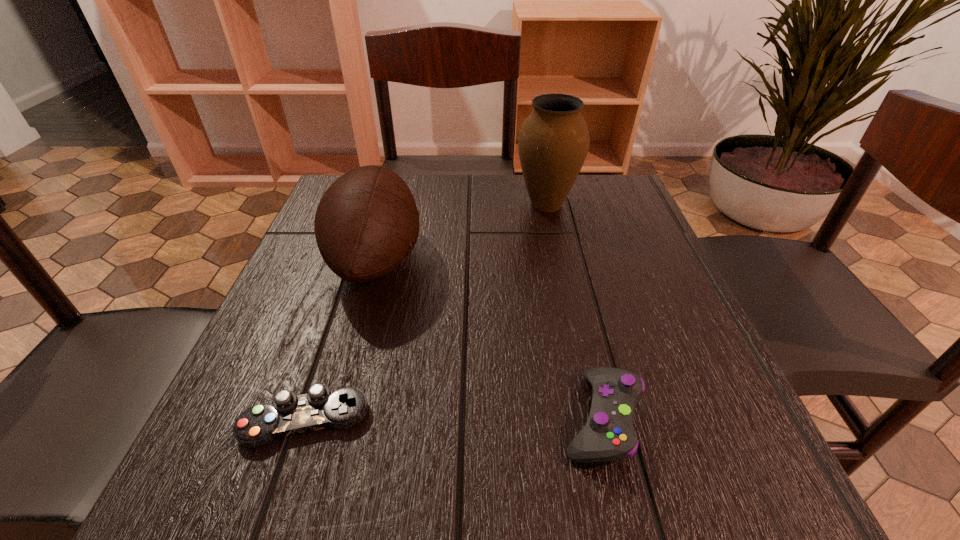
Where is `urn at the far edge`? Image resolution: width=960 pixels, height=540 pixels. urn at the far edge is located at coordinates (553, 142).

Where is `football that is at the far edge`? The width and height of the screenshot is (960, 540). football that is at the far edge is located at coordinates (367, 222).

Find the location of a particular element. This screenshot has height=540, width=960. football present at the left edge is located at coordinates (367, 222).

What are the coordinates of `control that is at the left edge` in the screenshot? It's located at (290, 414).

Where is `urn situated at the right edge`? The image size is (960, 540). urn situated at the right edge is located at coordinates (553, 142).

You are a GUI agent. You are given a task and a screenshot of the screen. Output one action in this format:
    pyautogui.click(x=<x>, y=<y>)
    Task: Click on the control located at the right edge
    
    Given the screenshot: What is the action you would take?
    pyautogui.click(x=609, y=435)

This screenshot has width=960, height=540. Identify the location of object located at the far left corner. (367, 222).

Find the location of a particular element. This screenshot has width=960, height=540. object that is at the near left corner is located at coordinates (290, 414).

Locate an element on the screen. object located at the far right corner is located at coordinates (553, 142).

The height and width of the screenshot is (540, 960). What are the coordinates of `object that is at the near right corner` in the screenshot? It's located at (609, 435).